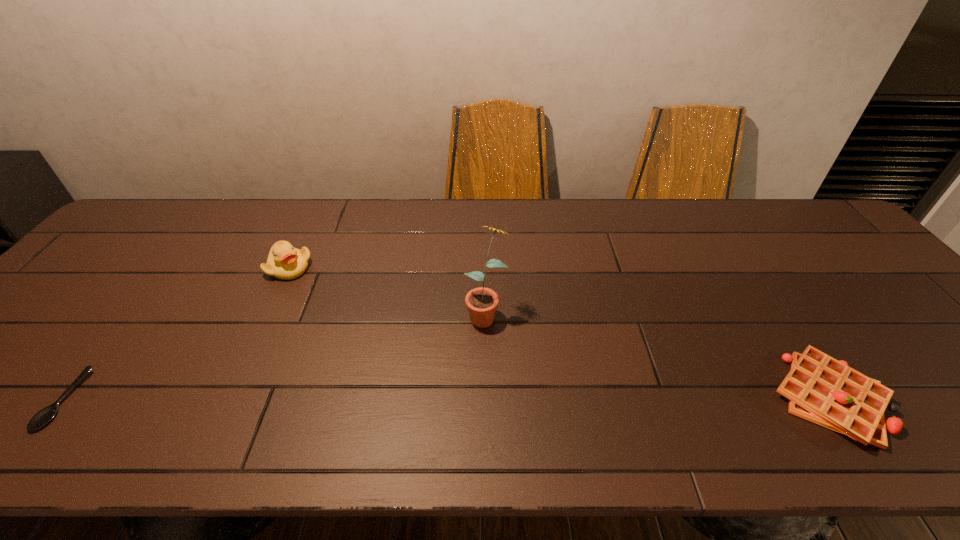
What are the coordinates of `the third closest object to the farthest object` in the screenshot? It's located at (821, 389).

Identify which object is the nearest to the third nearest object. Please provide its 2D coordinates. Your answer should be formatted as a tuple, i.e. [(x, y)], where the tuple contains the x and y coordinates of a point satisfying the conditions above.

[(285, 262)]